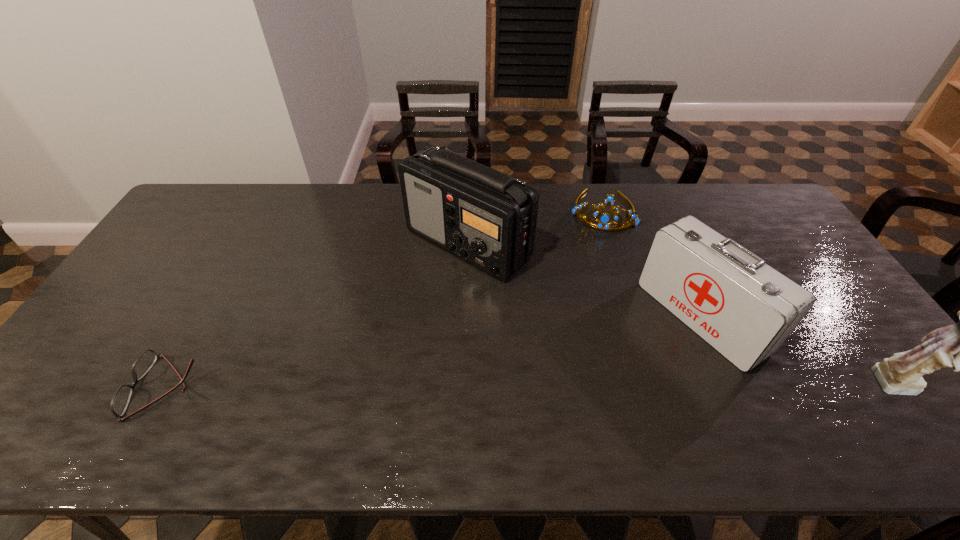
The height and width of the screenshot is (540, 960). In order to click on spectacles that is at the near edge in this screenshot , I will do `click(121, 398)`.

Find the location of a particular element. The width and height of the screenshot is (960, 540). figurine that is positioned at the near edge is located at coordinates (901, 374).

Find the location of `the first-aid kit at the near edge`. the first-aid kit at the near edge is located at coordinates (745, 309).

I want to click on object located at the right edge, so click(x=901, y=374).

Where is `object positioned at the near right corner`? object positioned at the near right corner is located at coordinates (901, 374).

Find the location of a particular element. vacant space at the far edge of the desktop is located at coordinates click(x=647, y=215).

This screenshot has height=540, width=960. In order to click on vacant space at the left edge of the desktop in this screenshot , I will do `click(104, 322)`.

You are a GUI agent. You are given a task and a screenshot of the screen. Output one action in this format:
    pyautogui.click(x=<x>, y=<y>)
    Task: Click on the free space at the right edge of the desktop
    The height and width of the screenshot is (540, 960).
    Given the screenshot: What is the action you would take?
    pyautogui.click(x=786, y=260)

Locate an element on the screen. This screenshot has height=540, width=960. vacant space at the far right corner of the desktop is located at coordinates (760, 206).

At what (x,y) coordinates should I click in order to perform the action: click on free space at the near right corner of the desktop. Please return your answer as a coordinate pair (x, y). Looking at the image, I should click on (885, 396).